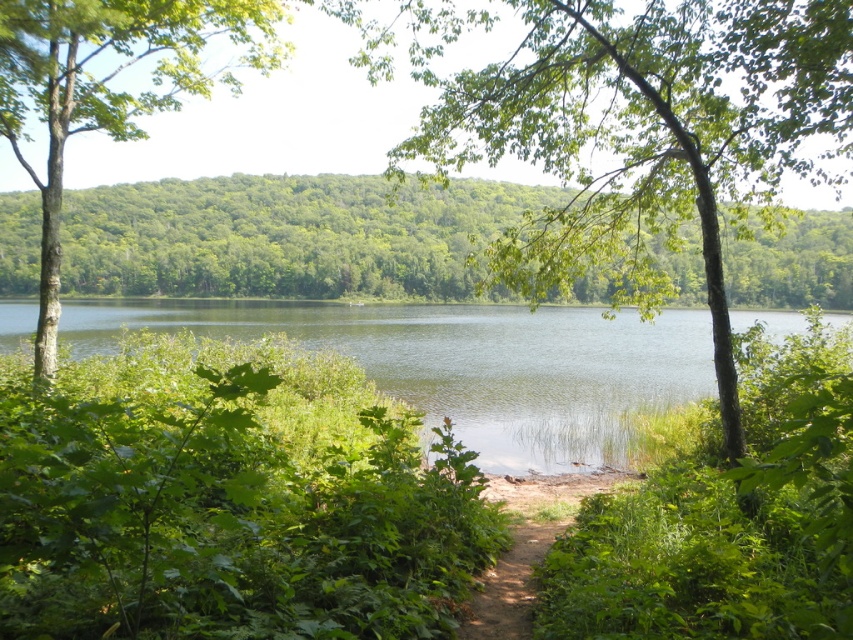
Does point (16, 195) come in front of point (50, 180)?

No.

This screenshot has width=853, height=640. What are the coordinates of `green leafy tree at upper center` in the screenshot? It's located at (287, 236).

Who is more forward, (785, 152) or (596, 397)?

Point (785, 152)

Does point (619, 244) come behind point (137, 326)?

No, (619, 244) is closer to viewer.

Identify the location of green leafy tree at center. The image size is (853, 640). (630, 129).

Is point (555, 156) positioned before point (538, 499)?

No, it is not.

Which is in front, point (451, 88) or point (503, 570)?

Point (503, 570) is more forward.

Describe the element at coordinates (630, 129) in the screenshot. I see `green leafy tree at center` at that location.

You are a GUI agent. You are given a task and a screenshot of the screen. Output one action in this format:
    pyautogui.click(x=<x>, y=<y>)
    Task: Click on the green leafy tree at center
    This screenshot has height=640, width=853.
    Given the screenshot: What is the action you would take?
    pyautogui.click(x=630, y=129)